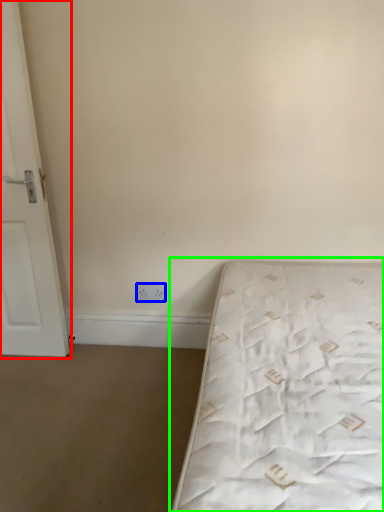
Question: Which object is positioned farthest from door (highlighted by a red box)? Select from electric outlet (highlighted by a blue box) and bed (highlighted by a green box).

Choices:
 (A) electric outlet
 (B) bed

Answer: (B)